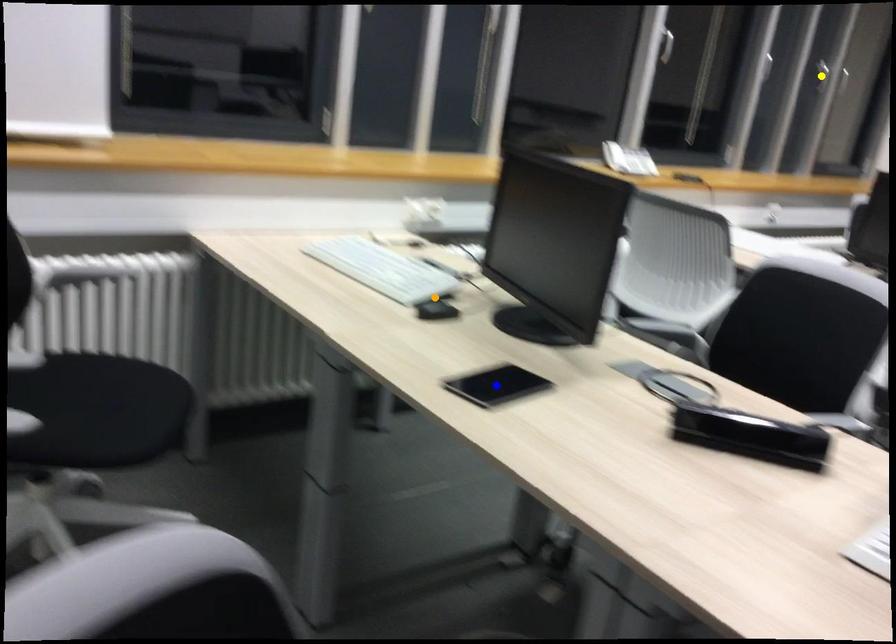
Order these from farthest to nearest:
blue point
orange point
yellow point

yellow point
orange point
blue point